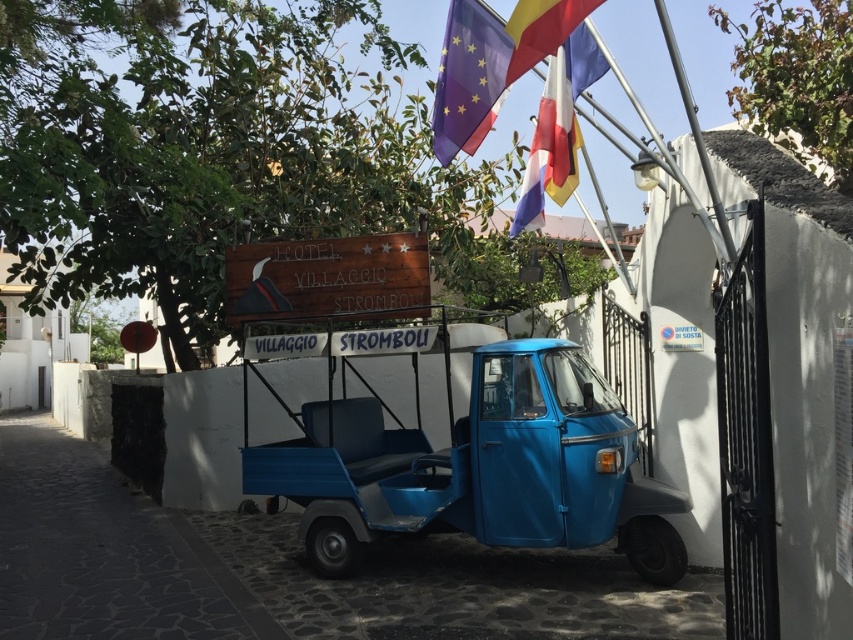
From the picture: You are standing at the point closest to the triciclo in the scene. Which of the two points, point (537, 180) or point (541, 33), is farther away from you?

Point (537, 180) is farther away from you because it is behind point (541, 33), which means the latter is closer to your position.

You are standing in front of the triciclo at the Hotel Villaggio Stromboli. You notice two points marked on the image. The first point is at coordinates point (56, 499) and the second is at point (558, 29). Which point is closer to you?

Point (56, 499) is closer to you because it is further to the viewer than point (558, 29).